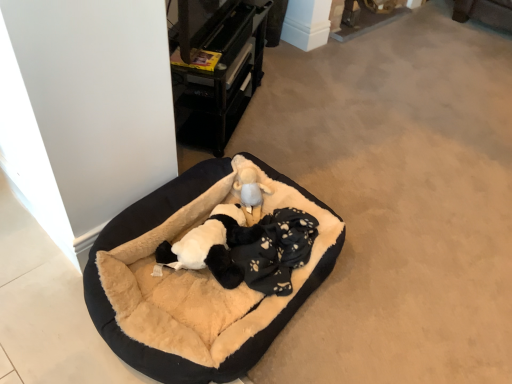
Question: Could you tell me if black plastic drawer at upper center is turned towards black plush dog at center?

Choices:
 (A) yes
 (B) no

Answer: (B)

Question: Can black plush dog at center be found inside black plastic drawer at upper center?

Choices:
 (A) yes
 (B) no

Answer: (B)

Question: Can you confirm if black plastic drawer at upper center is bigger than black plush dog at center?

Choices:
 (A) yes
 (B) no

Answer: (A)

Question: Is black plastic drawer at upper center next to black plush dog at center?

Choices:
 (A) yes
 (B) no

Answer: (B)

Question: Does black plastic drawer at upper center lie behind black plush dog at center?

Choices:
 (A) no
 (B) yes

Answer: (B)

Question: Relative to black plastic drawer at upper center, is black plush dog at center in front or behind?

Choices:
 (A) behind
 (B) front

Answer: (B)

Question: Does point (214, 264) appear closer or farther from the camera than point (257, 26)?

Choices:
 (A) farther
 (B) closer

Answer: (B)

Question: Considering the positions of black plush dog at center and black plastic drawer at upper center in the image, is black plush dog at center taller or shorter than black plastic drawer at upper center?

Choices:
 (A) tall
 (B) short

Answer: (B)

Question: From a real-world perspective, is black plush dog at center positioned above or below black plastic drawer at upper center?

Choices:
 (A) above
 (B) below

Answer: (B)

Question: Considering the positions of black plush dog bed at center and black plastic drawer at upper center in the image, is black plush dog bed at center taller or shorter than black plastic drawer at upper center?

Choices:
 (A) short
 (B) tall

Answer: (A)

Question: Is black plush dog bed at center to the left or to the right of black plastic drawer at upper center in the image?

Choices:
 (A) left
 (B) right

Answer: (B)

Question: Is black plush dog bed at center wider or thinner than black plastic drawer at upper center?

Choices:
 (A) wide
 (B) thin

Answer: (A)

Question: From a real-world perspective, is black plush dog bed at center physically located above or below black plastic drawer at upper center?

Choices:
 (A) below
 (B) above

Answer: (A)

Question: Based on their sizes in the image, would you say black plastic drawer at upper center is bigger or smaller than black plush dog bed at center?

Choices:
 (A) small
 (B) big

Answer: (A)

Question: From the image's perspective, is black plastic drawer at upper center located above or below black plush dog bed at center?

Choices:
 (A) above
 (B) below

Answer: (A)